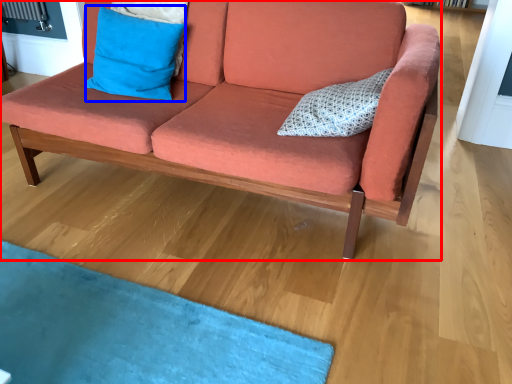
Question: Which object appears farthest to the camera in this image, studio couch (highlighted by a red box) or pillow (highlighted by a blue box)?

Choices:
 (A) studio couch
 (B) pillow

Answer: (B)